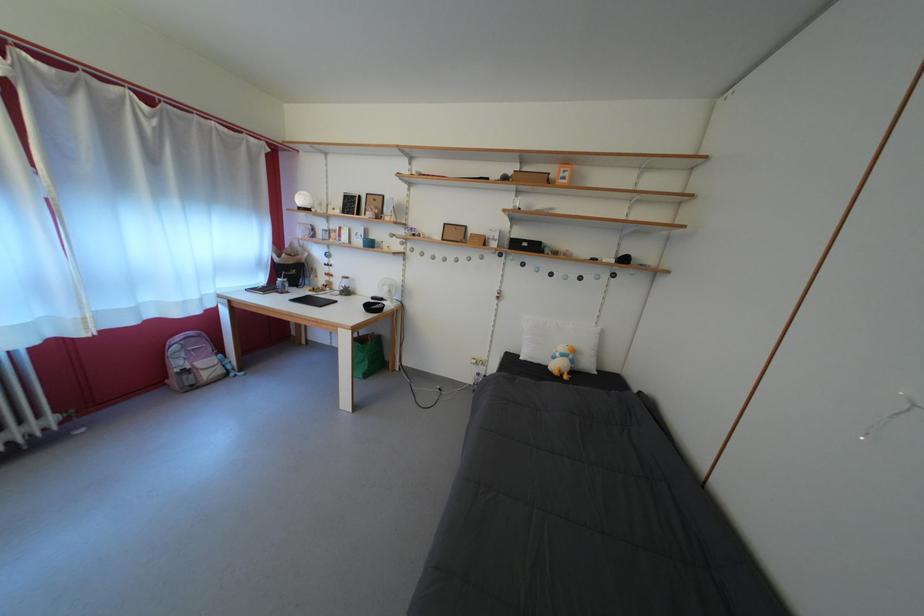
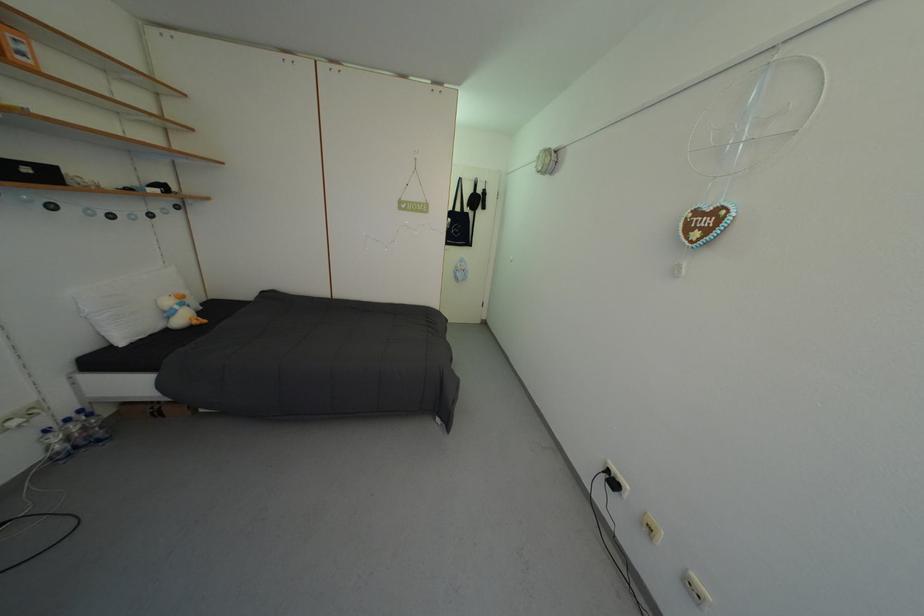
Locate, in the second image, the point that corresponds to pixel 565 361 in the first image.

(186, 313)